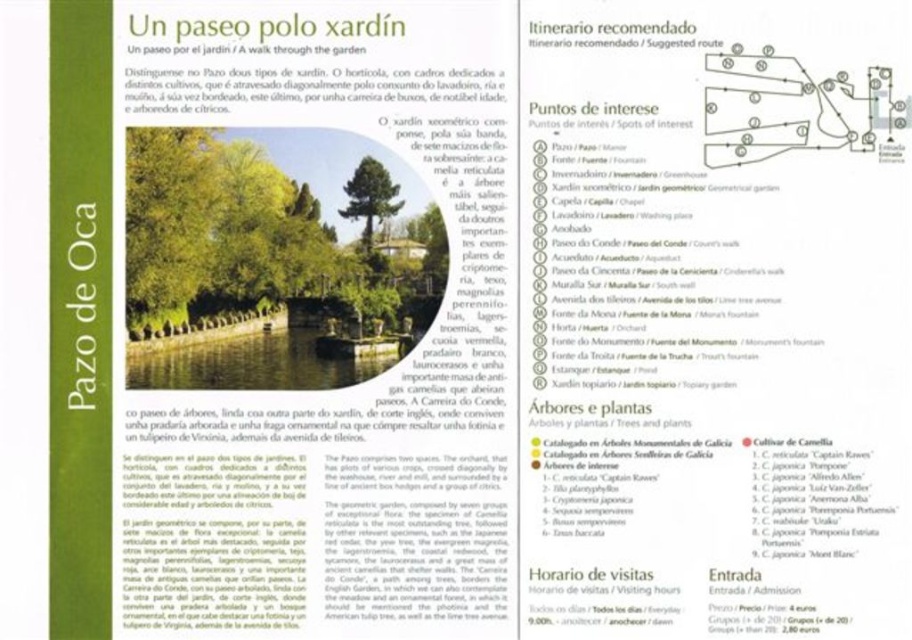
Who is taller, green paper at upper center or white paper at upper center?

green paper at upper center

Who is positioned more to the right, green paper at upper center or white paper at upper center?

white paper at upper center is more to the right.

Is point (287, 70) farther from camera compared to point (669, 33)?

That is True.

Locate an element on the screen. The height and width of the screenshot is (640, 912). green paper at upper center is located at coordinates (301, 86).